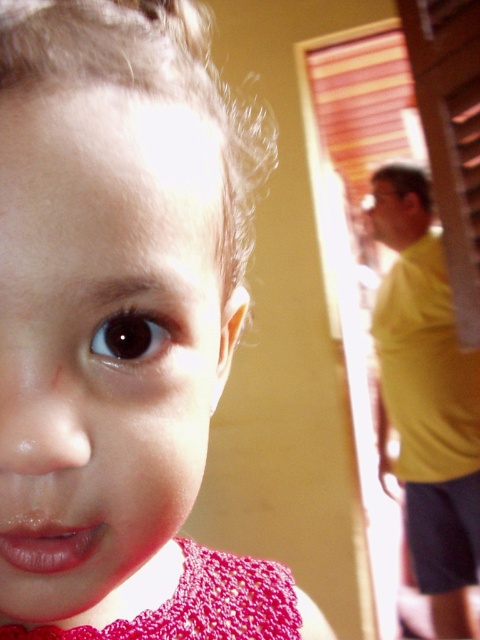
Measure the distance between point (14,225) and camera.

The distance of point (14,225) from camera is 8.26 inches.

Which is more to the right, matte pink lace dress at center or yellow matte shirt at right?

Positioned to the right is yellow matte shirt at right.

This screenshot has height=640, width=480. What do you see at coordinates (120, 326) in the screenshot? I see `matte pink lace dress at center` at bounding box center [120, 326].

The height and width of the screenshot is (640, 480). Find the location of `matte pink lace dress at center`. matte pink lace dress at center is located at coordinates tap(120, 326).

Which is below, matte pink lace dress at center or crochet fabric dress at lower left?

crochet fabric dress at lower left is below.

Looking at this image, who is higher up, matte pink lace dress at center or crochet fabric dress at lower left?

Positioned higher is matte pink lace dress at center.

What do you see at coordinates (120, 326) in the screenshot? I see `matte pink lace dress at center` at bounding box center [120, 326].

You are a GUI agent. You are given a task and a screenshot of the screen. Output one action in this format:
    pyautogui.click(x=<x>, y=<y>)
    Task: Click on the matte pink lace dress at center
    The width and height of the screenshot is (480, 640).
    Given the screenshot: What is the action you would take?
    pyautogui.click(x=120, y=326)

Between point (385, 401) and point (6, 627), which one is positioned in front?

Point (6, 627) is more forward.

Does yellow matte shirt at right appear on the left side of crochet fabric dress at lower left?

Incorrect, yellow matte shirt at right is not on the left side of crochet fabric dress at lower left.

Locate an element on the screen. The height and width of the screenshot is (640, 480). yellow matte shirt at right is located at coordinates (427, 400).